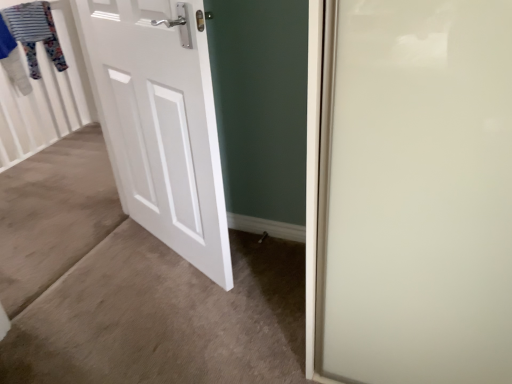
What do you see at coordinates (28, 38) in the screenshot?
I see `striped fabric clothesline at upper left` at bounding box center [28, 38].

What is the approximate width of striped fabric clothesline at upper left?

striped fabric clothesline at upper left is 5.88 inches in width.

Locate an element on the screen. The width and height of the screenshot is (512, 384). striped fabric clothesline at upper left is located at coordinates (28, 38).

Measure the distance between point (8, 17) and camera.

Point (8, 17) and camera are 8.33 feet apart from each other.

Describe the element at coordinates (161, 122) in the screenshot. I see `white matte door at left` at that location.

The width and height of the screenshot is (512, 384). Identify the location of white matte door at left. (161, 122).

I want to click on striped fabric clothesline at upper left, so click(x=28, y=38).

Which is more to the left, striped fabric clothesline at upper left or white matte door at left?

striped fabric clothesline at upper left.

Does striped fabric clothesline at upper left lie behind white matte door at left?

That is True.

Considering the points (25, 43) and (181, 196), which point is behind, point (25, 43) or point (181, 196)?

Point (25, 43)

From the image's perspective, which one is positioned higher, striped fabric clothesline at upper left or white matte door at left?

From the image's view, striped fabric clothesline at upper left is above.

From a real-world perspective, which object rests below the other?

From a 3D spatial view, white matte door at left is below.

Considering the sizes of striped fabric clothesline at upper left and white matte door at left in the image, is striped fabric clothesline at upper left wider or thinner than white matte door at left?

Considering their sizes, striped fabric clothesline at upper left looks broader than white matte door at left.

Which of these two, striped fabric clothesline at upper left or white matte door at left, stands shorter?

striped fabric clothesline at upper left is shorter.

Can you confirm if striped fabric clothesline at upper left is bigger than white matte door at left?

Actually, striped fabric clothesline at upper left might be smaller than white matte door at left.

Is striped fabric clothesline at upper left located outside white matte door at left?

That's correct, striped fabric clothesline at upper left is outside of white matte door at left.

Are striped fabric clothesline at upper left and white matte door at left beside each other?

striped fabric clothesline at upper left is not next to white matte door at left, and they're not touching.

Does striped fabric clothesline at upper left turn towards white matte door at left?

No, striped fabric clothesline at upper left is not facing towards white matte door at left.

At what (x,y) coordinates should I click in order to perform the action: click on door on the right of striped fabric clothesline at upper left. Please return your answer as a coordinate pair (x, y). Image resolution: width=512 pixels, height=384 pixels. Looking at the image, I should click on (161, 122).

In the scene shown: Which object is positioned more to the left, white matte door at left or striped fabric clothesline at upper left?

Positioned to the left is striped fabric clothesline at upper left.

Relative to striped fabric clothesline at upper left, is white matte door at left in front or behind?

In the image, white matte door at left appears in front of striped fabric clothesline at upper left.

Considering the positions of point (190, 52) and point (62, 70), is point (190, 52) closer or farther from the camera than point (62, 70)?

Point (190, 52) is closer to the camera than point (62, 70).

From the image's perspective, which one is positioned higher, white matte door at left or striped fabric clothesline at upper left?

striped fabric clothesline at upper left, from the image's perspective.

Looking at this image, from a real-world perspective, is white matte door at left on top of striped fabric clothesline at upper left?

No.

Between white matte door at left and striped fabric clothesline at upper left, which one has smaller width?

white matte door at left.

Which of these two, white matte door at left or striped fabric clothesline at upper left, stands taller?

white matte door at left.

Is white matte door at left smaller than striped fabric clothesline at upper left?

No.

Is striped fabric clothesline at upper left located within white matte door at left?

Definitely not — striped fabric clothesline at upper left is not inside white matte door at left.

Would you consider white matte door at left to be distant from striped fabric clothesline at upper left?

white matte door at left is far away from striped fabric clothesline at upper left.

Is white matte door at left looking in the opposite direction of striped fabric clothesline at upper left?

No, white matte door at left is not facing the opposite direction of striped fabric clothesline at upper left.

How distant is white matte door at left from striped fabric clothesline at upper left?

white matte door at left is 4.82 feet from striped fabric clothesline at upper left.

Where is `clothesline that appears above the white matte door at left (from a real-world perspective)`? The width and height of the screenshot is (512, 384). clothesline that appears above the white matte door at left (from a real-world perspective) is located at coordinates (28, 38).

Find the location of a particular element. The width and height of the screenshot is (512, 384). door below the striped fabric clothesline at upper left (from a real-world perspective) is located at coordinates coord(161,122).

Find the location of `clothesline above the white matte door at left (from the image's perspective)`. clothesline above the white matte door at left (from the image's perspective) is located at coordinates (28, 38).